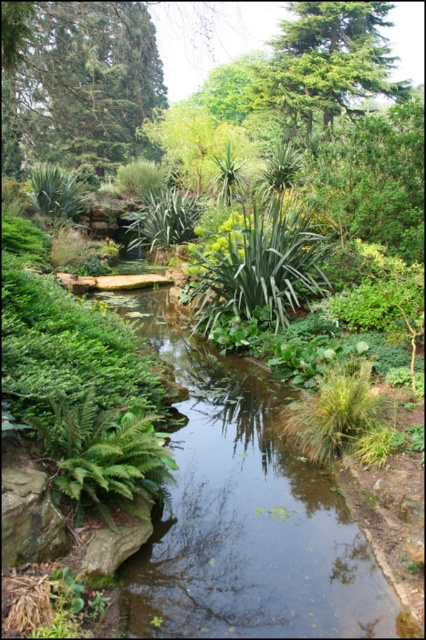
You are standing at the edge of the stream and see the green leafy fern at center and the green matte fern at lower left. Which fern is positioned more to the right side of the stream?

The green leafy fern at center is positioned more to the right side of the stream than the green matte fern at lower left.

Consider the image. You are a hiker who wants to cross the stream. You have a 10 cm wide board. The green leafy stream at center and green leafy fern at center are in your way. Can the board fit across the stream?

The green leafy stream at center is thinner than green leafy fern at center. Since the stream is thinner, the 10 cm board can fit across the stream.